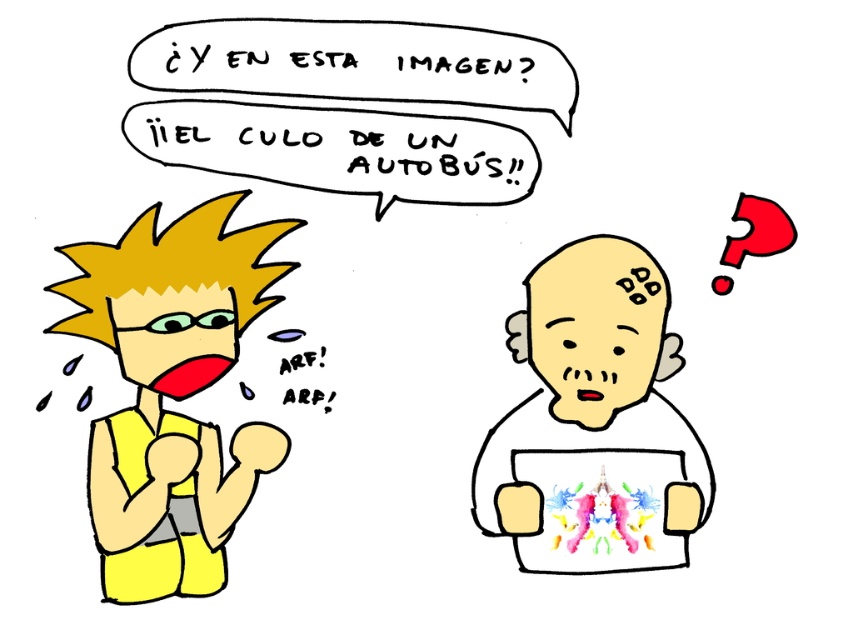
Can you confirm if smooth beige head at center is bigger than yellow matte/silky hair at left?

No, smooth beige head at center is not bigger than yellow matte/silky hair at left.

Does smooth beige head at center appear on the left side of yellow matte/silky hair at left?

Incorrect, smooth beige head at center is not on the left side of yellow matte/silky hair at left.

Does point (640, 292) lie in front of point (144, 276)?

No, (640, 292) is further to viewer.

Locate an element on the screen. The width and height of the screenshot is (853, 640). smooth beige head at center is located at coordinates (595, 422).